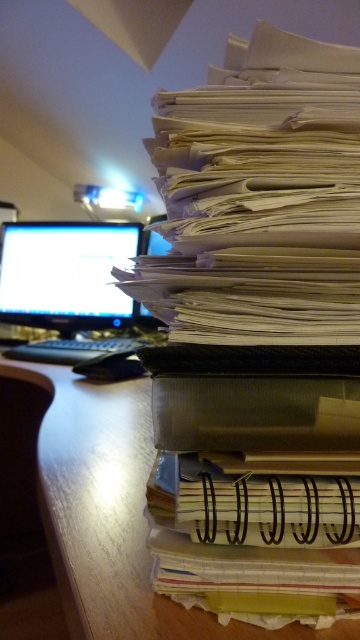
Question: Which object appears farthest from the camera in this image?

Choices:
 (A) wooden at right
 (B) matte black monitor at left

Answer: (B)

Question: In this image, where is wooden at right located relative to matte black monitor at left?

Choices:
 (A) below
 (B) above

Answer: (A)

Question: Is wooden at right positioned in front of matte black monitor at left?

Choices:
 (A) yes
 (B) no

Answer: (A)

Question: Among these objects, which one is farthest from the camera?

Choices:
 (A) matte black monitor at left
 (B) wooden at right

Answer: (A)

Question: Observing the image, what is the correct spatial positioning of wooden at right in reference to matte black monitor at left?

Choices:
 (A) above
 (B) below

Answer: (B)

Question: Which point is farther to the camera?

Choices:
 (A) matte black monitor at left
 (B) wooden at right

Answer: (A)